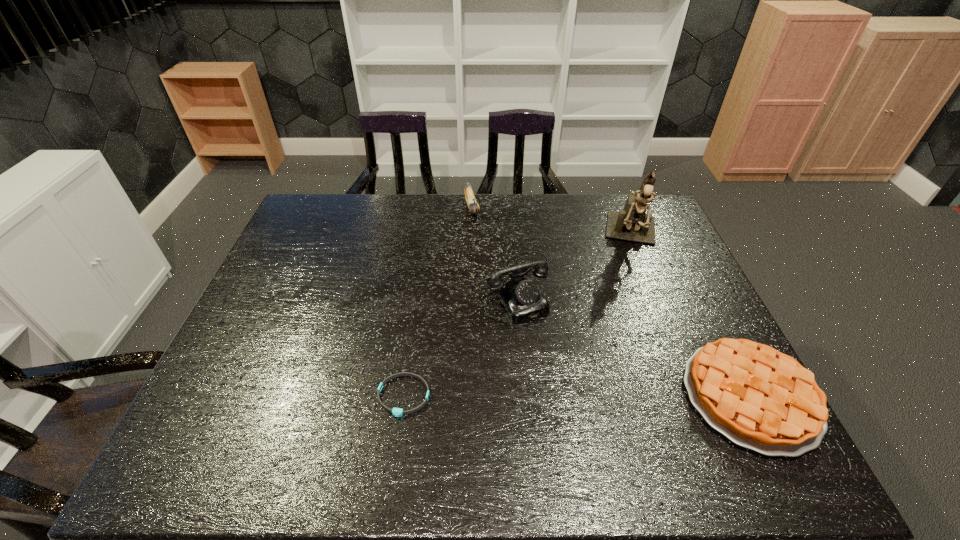
The height and width of the screenshot is (540, 960). I want to click on vacant space on the desktop that is between the shortest object and the pie and is positioned on the front-facing side of the telephone, so 581,396.

At what (x,y) coordinates should I click in order to perform the action: click on vacant space on the desktop that is between the leftmost object and the fourth tallest object and is positioned on the front-facing side of the tallest object. Please return your answer as a coordinate pair (x, y). This screenshot has height=540, width=960. Looking at the image, I should click on (628, 396).

The image size is (960, 540). Identify the location of vacant space on the desktop that is between the shortest object and the second shortest object and is positioned at the stem of the banana. (526, 396).